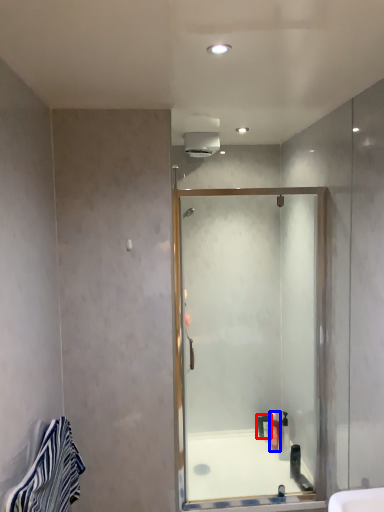
Question: Which object is further to the camera taking this photo, toiletry (highlighted by a red box) or toiletry (highlighted by a blue box)?

Choices:
 (A) toiletry
 (B) toiletry

Answer: (A)